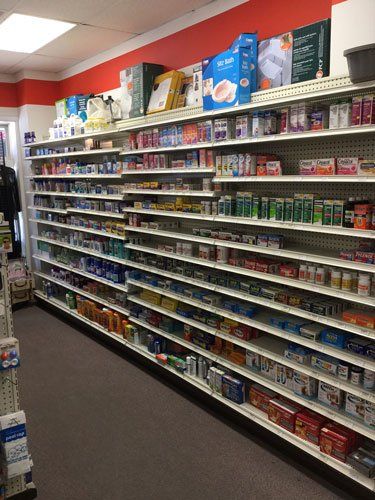
Where is `window`? The image size is (375, 500). window is located at coordinates (4, 130).